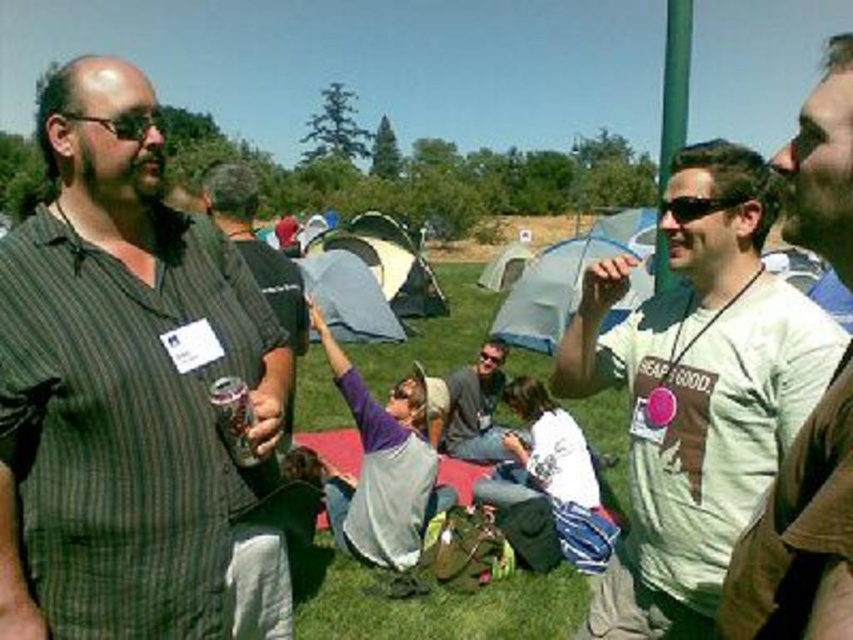
I want to click on striped cotton shirt at left, so click(120, 385).

Who is positioned more to the left, striped cotton shirt at left or white fabric tent at center?

striped cotton shirt at left

Find the location of `striped cotton shirt at left`. striped cotton shirt at left is located at coordinates (120, 385).

Does white fabric tent at center appear on the left side of sunglasses at center?

In fact, white fabric tent at center is to the right of sunglasses at center.

Who is higher up, white fabric tent at center or sunglasses at center?

white fabric tent at center is higher up.

What do you see at coordinates (506, 264) in the screenshot?
I see `white fabric tent at center` at bounding box center [506, 264].

Locate an element on the screen. This screenshot has width=853, height=640. white fabric tent at center is located at coordinates (506, 264).

From the picture: Who is positioned more to the right, striped cotton shirt at left or black plastic glasses at left?

From the viewer's perspective, striped cotton shirt at left appears more on the right side.

Which is in front, point (236, 268) or point (67, 118)?

Point (67, 118) is more forward.

This screenshot has height=640, width=853. What do you see at coordinates (120, 385) in the screenshot? I see `striped cotton shirt at left` at bounding box center [120, 385].

Locate an element on the screen. striped cotton shirt at left is located at coordinates point(120,385).